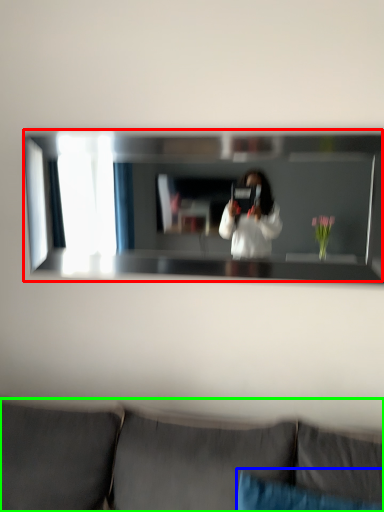
Question: Estimate the real-world distances between objects in this image. Which object is farther from mirror (highlighted by a red box), pillow (highlighted by a blue box) or studio couch (highlighted by a green box)?

Choices:
 (A) pillow
 (B) studio couch

Answer: (A)